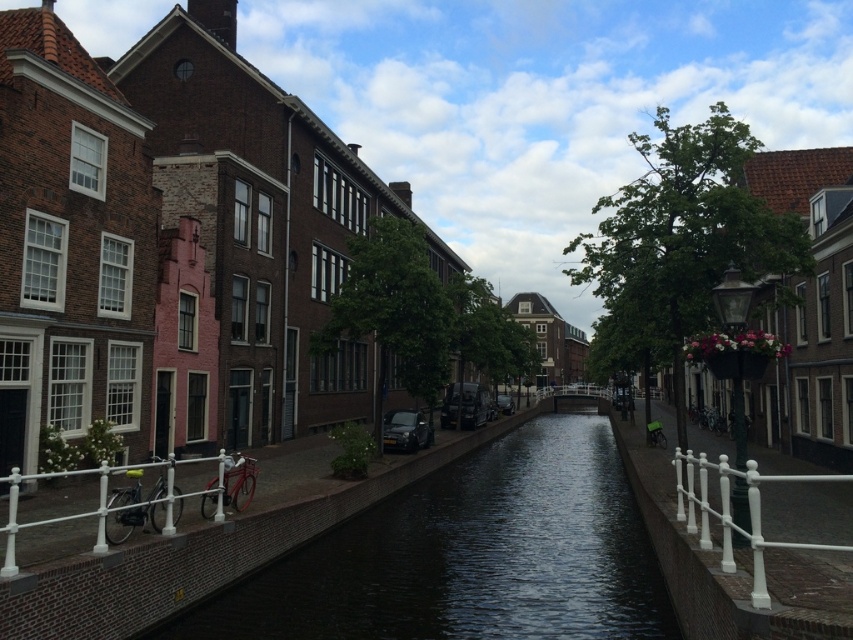
Between white metal railing at lower right and metallic bicycle at lower left, which one appears on the right side from the viewer's perspective?

white metal railing at lower right is more to the right.

Does white metal railing at lower right appear on the right side of metallic bicycle at lower left?

Correct, you'll find white metal railing at lower right to the right of metallic bicycle at lower left.

The height and width of the screenshot is (640, 853). Find the location of `white metal railing at lower right`. white metal railing at lower right is located at coordinates (732, 513).

Image resolution: width=853 pixels, height=640 pixels. I want to click on white metal railing at lower right, so click(x=732, y=513).